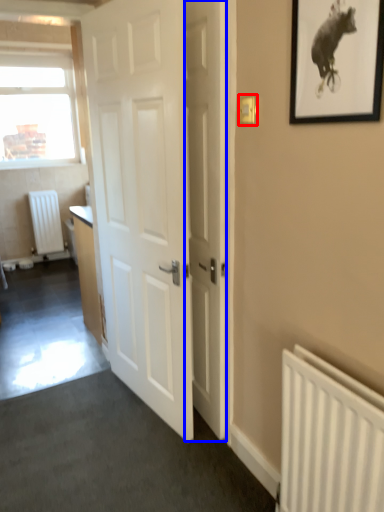
Question: Which point is further to the camera, light switch (highlighted by a red box) or door (highlighted by a blue box)?

Choices:
 (A) light switch
 (B) door

Answer: (B)